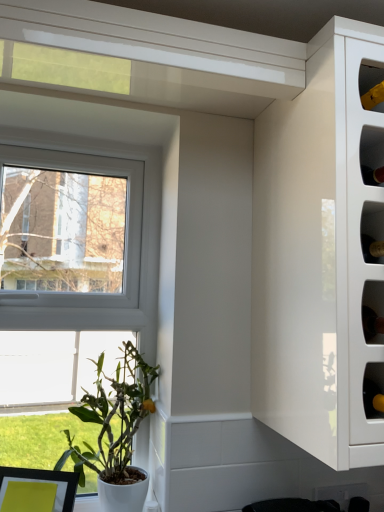
Question: Can you confirm if green matte plant at lower left is positioned to the right of white glossy cabinet at upper right?

Choices:
 (A) yes
 (B) no

Answer: (B)

Question: Is green matte plant at lower left outside white glossy cabinet at upper right?

Choices:
 (A) yes
 (B) no

Answer: (A)

Question: Could white glossy cabinet at upper right be considered to be inside green matte plant at lower left?

Choices:
 (A) yes
 (B) no

Answer: (B)

Question: Is green matte plant at lower left shorter than white glossy cabinet at upper right?

Choices:
 (A) yes
 (B) no

Answer: (A)

Question: Can you confirm if green matte plant at lower left is bigger than white glossy cabinet at upper right?

Choices:
 (A) no
 (B) yes

Answer: (A)

Question: From the image's perspective, does green matte plant at lower left appear lower than white glossy cabinet at upper right?

Choices:
 (A) no
 (B) yes

Answer: (B)

Question: Is white glossy cabinet at upper right outside of green matte plant at lower left?

Choices:
 (A) yes
 (B) no

Answer: (A)

Question: Considering the relative sizes of white glossy cabinet at upper right and green matte plant at lower left in the image provided, is white glossy cabinet at upper right taller than green matte plant at lower left?

Choices:
 (A) yes
 (B) no

Answer: (A)

Question: Is white glossy cabinet at upper right closer to the viewer compared to green matte plant at lower left?

Choices:
 (A) no
 (B) yes

Answer: (B)

Question: From the image's perspective, is white glossy cabinet at upper right on green matte plant at lower left?

Choices:
 (A) no
 (B) yes

Answer: (B)

Question: Does white glossy cabinet at upper right have a lesser height compared to green matte plant at lower left?

Choices:
 (A) no
 (B) yes

Answer: (A)

Question: Is white glossy cabinet at upper right bigger than green matte plant at lower left?

Choices:
 (A) no
 (B) yes

Answer: (B)

Question: Is white glossy cabinet at upper right to the left or to the right of green matte plant at lower left in the image?

Choices:
 (A) right
 (B) left

Answer: (A)